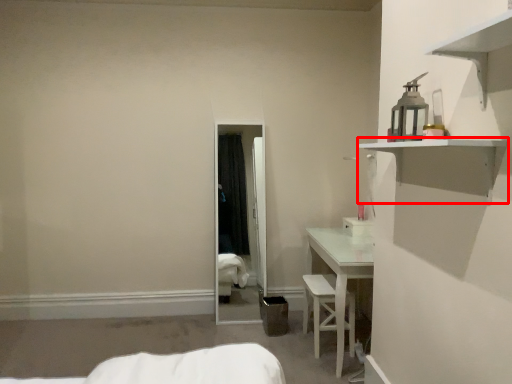
Question: From the image's perspective, considering the relative positions of shelf (annotated by the red box) and armchair in the image provided, where is shelf (annotated by the red box) located with respect to the staircase?

Choices:
 (A) above
 (B) below

Answer: (A)